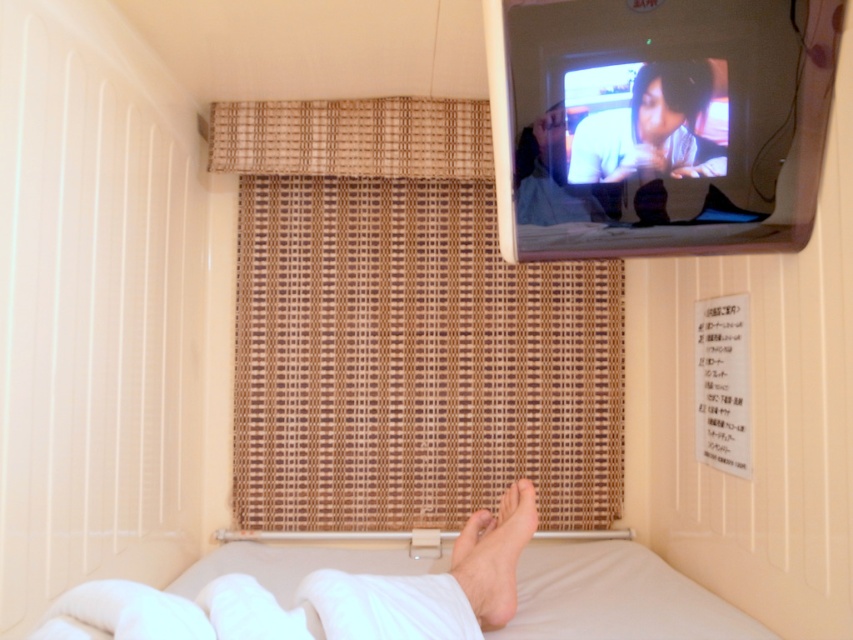
Does bamboo curtain at upper center have a lesser width compared to white soft foot at lower center?

Incorrect, bamboo curtain at upper center's width is not less than white soft foot at lower center's.

This screenshot has width=853, height=640. Describe the element at coordinates (405, 326) in the screenshot. I see `bamboo curtain at upper center` at that location.

At what (x,y) coordinates should I click in order to perform the action: click on bamboo curtain at upper center. Please return your answer as a coordinate pair (x, y). This screenshot has width=853, height=640. Looking at the image, I should click on (405, 326).

At what (x,y) coordinates should I click in order to perform the action: click on bamboo curtain at upper center. Please return your answer as a coordinate pair (x, y). Image resolution: width=853 pixels, height=640 pixels. Looking at the image, I should click on 405,326.

Measure the distance between bamboo curtain at upper center and smooth skin face at upper center.

The distance of bamboo curtain at upper center from smooth skin face at upper center is 90.07 centimeters.

Does point (389, 250) come behind point (543, 186)?

Yes.

Image resolution: width=853 pixels, height=640 pixels. Identify the location of bamboo curtain at upper center. (405, 326).

In the scene shown: Is white soft bed at lower center closer to the viewer compared to white soft foot at lower center?

No, white soft bed at lower center is behind white soft foot at lower center.

Consider the image. Who is higher up, white soft bed at lower center or white soft foot at lower center?

white soft foot at lower center

Locate an element on the screen. This screenshot has height=640, width=853. white soft bed at lower center is located at coordinates (614, 596).

You are a GUI agent. You are given a task and a screenshot of the screen. Output one action in this format:
    pyautogui.click(x=<x>, y=<y>)
    Task: Click on the white soft bed at lower center
    The image size is (853, 640).
    Given the screenshot: What is the action you would take?
    pyautogui.click(x=614, y=596)